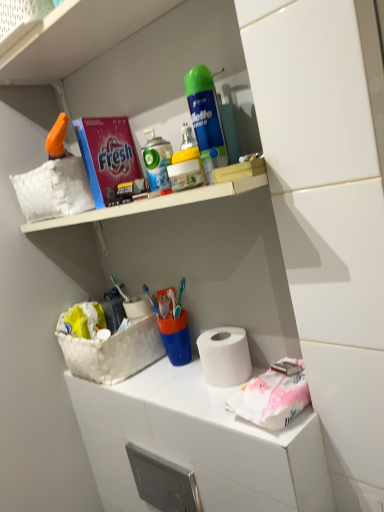
What do you see at coordinates (114, 352) in the screenshot? The height and width of the screenshot is (512, 384). I see `white woven basket at lower left` at bounding box center [114, 352].

Where is `white matte paper towel at center`? This screenshot has width=384, height=512. white matte paper towel at center is located at coordinates (224, 356).

At what (x,y) coordinates should I click in order to perform the action: click on green matte shaving cream can at upper center, the first cleaning product viewed from the top. Please return your answer as a coordinate pair (x, y). Looking at the image, I should click on (206, 119).

Measure the distance between point (216, 129) and camera.

The depth of point (216, 129) is 29.33 inches.

Describe the element at coordinates (272, 397) in the screenshot. The image size is (384, 512). I see `pink paper at lower right` at that location.

What is the approximate height of white plastic spray can at upper center?

white plastic spray can at upper center is 5.19 inches tall.

Locate an element on the screen. white matte toilet paper at lower center is located at coordinates (199, 443).

What do you see at coordinates (186, 164) in the screenshot? This screenshot has height=512, width=384. I see `yellow matte spray can at upper center, which appears as the second cleaning product when viewed from the top` at bounding box center [186, 164].

This screenshot has height=512, width=384. I want to click on pink cardboard box at upper left, so click(x=107, y=155).

Is pink cardboard box at upper left not near pink paper at lower right?

That's not correct — pink cardboard box at upper left is a little close to pink paper at lower right.

From a real-world perspective, is pink cardboard box at upper left positioned over pink paper at lower right based on gravity?

Yes, from a real-world perspective, pink cardboard box at upper left is over pink paper at lower right

Considering the positions of objects pink cardboard box at upper left and pink paper at lower right in the image provided, who is more to the right, pink cardboard box at upper left or pink paper at lower right?

Positioned to the right is pink paper at lower right.

From the image's perspective, is white matte toilet paper at lower center on green matte shaving cream can at upper center, the second cleaning product positioned from the bottom?

Incorrect, from the image's perspective, white matte toilet paper at lower center is lower than green matte shaving cream can at upper center, the second cleaning product positioned from the bottom.

Looking at this image, could you tell me if white matte toilet paper at lower center is turned towards green matte shaving cream can at upper center, the second cleaning product positioned from the bottom?

No, white matte toilet paper at lower center is not facing towards green matte shaving cream can at upper center, the second cleaning product positioned from the bottom.

Does point (173, 457) come farther from viewer compared to point (213, 156)?

Yes, it is.

Is white matte paper towel at center beside pink paper at lower right?

No, white matte paper towel at center is not making contact with pink paper at lower right.

Which object is further away from the camera, white matte paper towel at center or pink paper at lower right?

white matte paper towel at center is behind.

Could you tell me if white matte paper towel at center is facing pink paper at lower right?

No, white matte paper towel at center is not oriented towards pink paper at lower right.

Is white matte paper towel at center bigger or smaller than pink paper at lower right?

Considering their sizes, white matte paper towel at center takes up more space than pink paper at lower right.

Find the location of a particular element. The width and height of the screenshot is (384, 512). stationery below the green matte shaving cream can at upper center, the second cleaning product positioned from the bottom (from a real-world perspective) is located at coordinates (157, 160).

Is white plastic spray can at upper center positioned with its back to green matte shaving cream can at upper center, the second cleaning product positioned from the bottom?

That's not correct — white plastic spray can at upper center is not looking away from green matte shaving cream can at upper center, the second cleaning product positioned from the bottom.

Can you tell me how much white plastic spray can at upper center and green matte shaving cream can at upper center, the first cleaning product viewed from the top, differ in facing direction?

white plastic spray can at upper center and green matte shaving cream can at upper center, the first cleaning product viewed from the top, are facing 0.000174 degrees away from each other.

From the image's perspective, which object appears higher, green matte shaving cream can at upper center, the second cleaning product positioned from the bottom, or white plastic spray can at upper center?

green matte shaving cream can at upper center, the second cleaning product positioned from the bottom, appears higher in the image.

From a real-world perspective, is green matte shaving cream can at upper center, the first cleaning product viewed from the top, physically located above or below white plastic spray can at upper center?

From a real-world perspective, green matte shaving cream can at upper center, the first cleaning product viewed from the top, is physically above white plastic spray can at upper center.

Locate an element on the screen. The height and width of the screenshot is (512, 384). stationery lying behind the green matte shaving cream can at upper center, the first cleaning product viewed from the top is located at coordinates (157, 160).

Is white woven basket at upper left smaller than white matte paper towel at center?

No, white woven basket at upper left is not smaller than white matte paper towel at center.

Which is closer to the camera, (121, 72) or (218, 374)?

The point (218, 374) is closer to the camera.

Image resolution: width=384 pixels, height=512 pixels. I want to click on shelf above the white matte paper towel at center (from a real-world perspective), so click(x=160, y=68).

Is white woven basket at upper left next to white matte paper towel at center?

No, white woven basket at upper left is not beside white matte paper towel at center.

Is pink paper at lower right taller than white woven basket at lower left?

No, pink paper at lower right is not taller than white woven basket at lower left.

Would you say white woven basket at lower left is part of pink paper at lower right's contents?

No, white woven basket at lower left is not inside pink paper at lower right.

Which object is thinner, pink paper at lower right or white woven basket at lower left?

pink paper at lower right is thinner.

What are the coordinates of `material lying below the white woven basket at lower left (from the image's perspective)` in the screenshot? It's located at (272, 397).

Locate an element on the screen. product that appears behind the pink paper at lower right is located at coordinates [107, 155].

Where is `counter that is below the green matte shaving cream can at upper center, the first cleaning product viewed from the top (from the image's perspective)`? This screenshot has height=512, width=384. counter that is below the green matte shaving cream can at upper center, the first cleaning product viewed from the top (from the image's perspective) is located at coordinates (199, 443).

Based on their spatial positions, is pink cardboard box at upper left or white matte toilet paper at lower center further from yellow matte spray can at upper center, which appears as the second cleaning product when viewed from the top?

white matte toilet paper at lower center is further to yellow matte spray can at upper center, which appears as the second cleaning product when viewed from the top.

When comparing their distances from white plastic spray can at upper center, does pink cardboard box at upper left or white matte paper towel at center seem closer?

pink cardboard box at upper left is closer to white plastic spray can at upper center.

Considering their positions, is white matte paper towel at center positioned further to white matte toilet paper at lower center than white woven basket at lower left?

Based on the image, white matte paper towel at center appears to be further to white matte toilet paper at lower center.

Based on their spatial positions, is white woven basket at upper left or white woven basket at lower left closer to pink cardboard box at upper left?

white woven basket at upper left.

Estimate the real-world distances between objects in this image. Which object is closer to pink paper at lower right, white matte toilet paper at lower center or white matte paper towel at center?

white matte paper towel at center.

Considering their positions, is yellow matte spray can at upper center, the 1th cleaning product when ordered from bottom to top, positioned closer to white woven basket at upper left than white matte toilet paper at lower center?

Based on the image, yellow matte spray can at upper center, the 1th cleaning product when ordered from bottom to top, appears to be nearer to white woven basket at upper left.

Based on their spatial positions, is white matte toilet paper at lower center or white plastic spray can at upper center further from pink cardboard box at upper left?

Based on the image, white matte toilet paper at lower center appears to be further to pink cardboard box at upper left.

Based on their spatial positions, is pink paper at lower right or pink cardboard box at upper left further from white woven basket at lower left?

The object further to white woven basket at lower left is pink paper at lower right.

Where is `stationery between white woven basket at upper left and white matte paper towel at center in the up-down direction`? The height and width of the screenshot is (512, 384). stationery between white woven basket at upper left and white matte paper towel at center in the up-down direction is located at coordinates (157, 160).

Locate an element on the screen. stationery that lies between pink cardboard box at upper left and white matte toilet paper at lower center from top to bottom is located at coordinates tap(157, 160).

You are a GUI agent. You are given a task and a screenshot of the screen. Output one action in this format:
    pyautogui.click(x=<x>, y=<y>)
    Task: Click on the paper towel between white plastic spray can at upper center and white matte toilet paper at lower center from top to bottom
    
    Given the screenshot: What is the action you would take?
    (x=224, y=356)

The height and width of the screenshot is (512, 384). I want to click on product that lies between green matte shaving cream can at upper center, the second cleaning product positioned from the bottom, and pink paper at lower right from top to bottom, so click(107, 155).